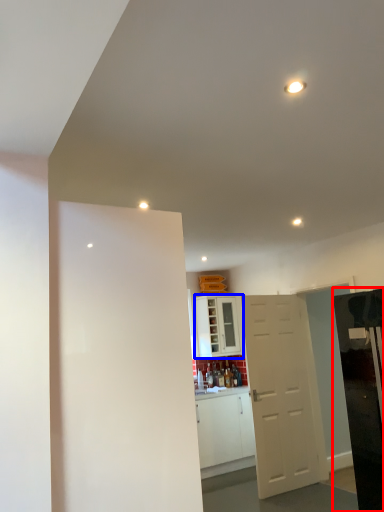
Question: Which object appears closest to the camera in this image, appliance (highlighted by a red box) or cabinetry (highlighted by a blue box)?

Choices:
 (A) appliance
 (B) cabinetry

Answer: (A)